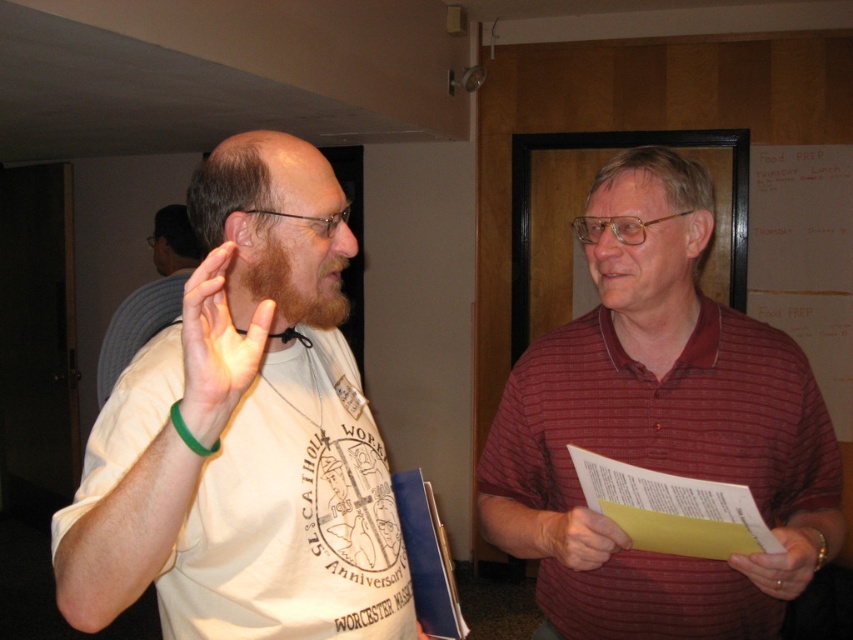
Question: Can you confirm if matte white t-shirt at left is thinner than striped cotton shirt at center?

Choices:
 (A) yes
 (B) no

Answer: (A)

Question: Does matte white t-shirt at left appear under striped cotton shirt at center?

Choices:
 (A) no
 (B) yes

Answer: (B)

Question: Which object is the closest to the matte white t-shirt at left?

Choices:
 (A) matte white shirt at center
 (B) striped cotton shirt at center

Answer: (B)

Question: Can you confirm if striped cotton shirt at center is wider than matte white shirt at center?

Choices:
 (A) no
 (B) yes

Answer: (B)

Question: Which of these objects is positioned farthest from the matte white shirt at center?

Choices:
 (A) matte white t-shirt at left
 (B) striped cotton shirt at center

Answer: (B)

Question: Which of the following is the farthest from the observer?

Choices:
 (A) striped cotton shirt at center
 (B) matte white shirt at center

Answer: (B)